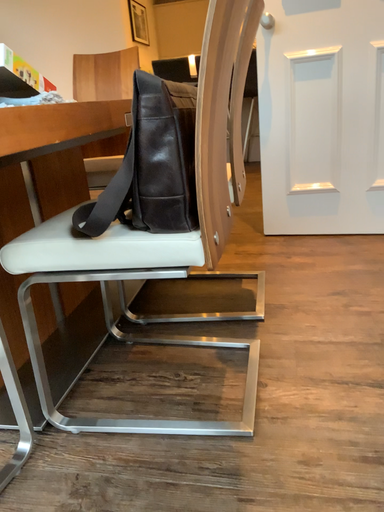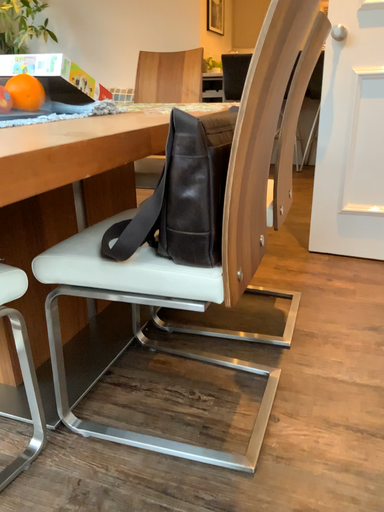
Question: Which way did the camera rotate in the video?

Choices:
 (A) rotated left
 (B) rotated right

Answer: (A)